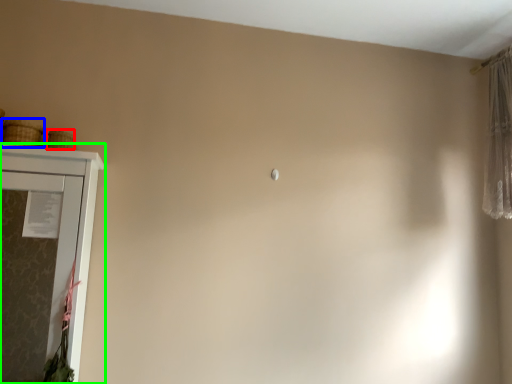
Question: Which is farther away from basket (highlighted by a red box)? basket (highlighted by a blue box) or cupboard (highlighted by a green box)?

Choices:
 (A) basket
 (B) cupboard

Answer: (B)